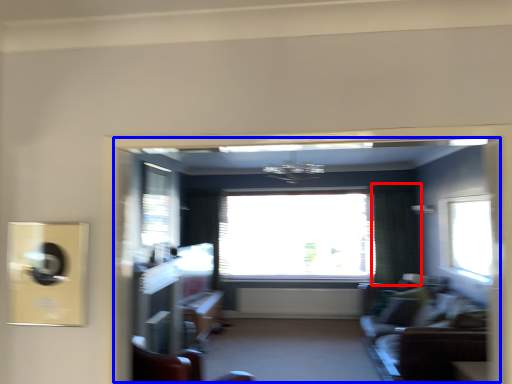
Question: Which object is further to the camera taking this photo, curtain (highlighted by a red box) or hotel lobby (highlighted by a blue box)?

Choices:
 (A) curtain
 (B) hotel lobby

Answer: (A)